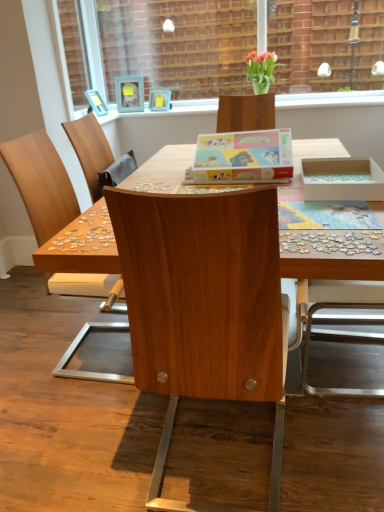
The height and width of the screenshot is (512, 384). I want to click on free spot below wooden chair at center (from a real-world perspective), so click(x=107, y=349).